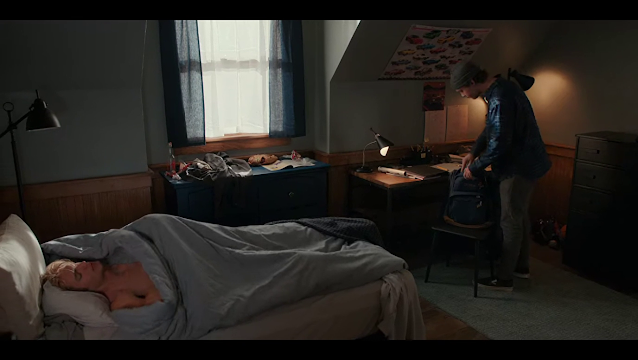
Find the location of a particular element. lamp is located at coordinates (43, 130).